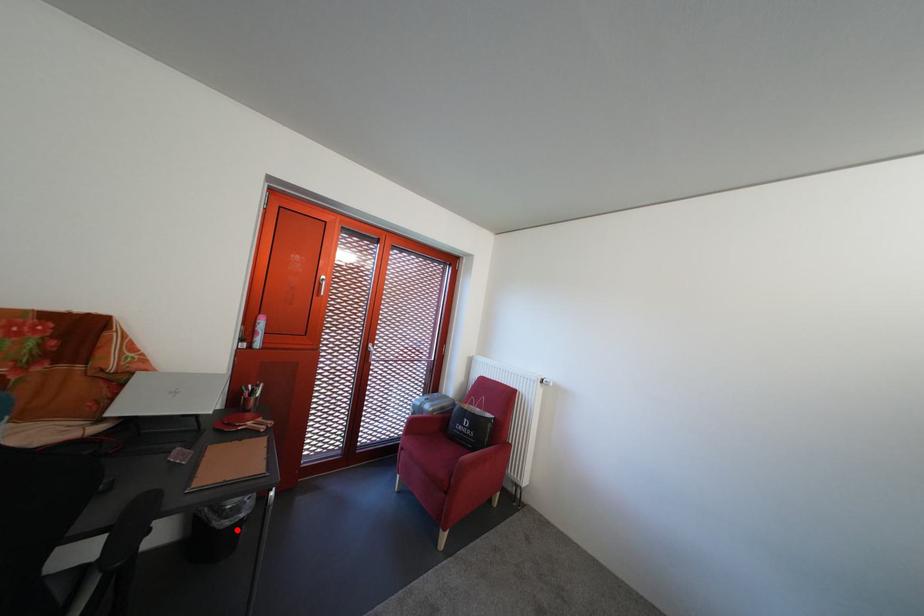
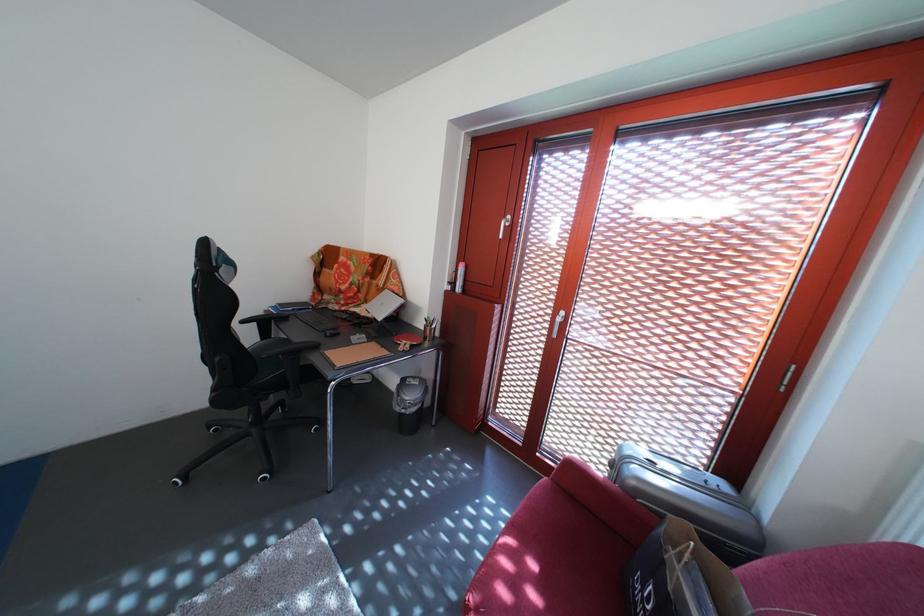
Question: I am providing you with two images of the same scene from different viewpoints. A red point is shown in image1. For the corresponding object point in image2, is it positioned nearer or farther from the camera?

Choices:
 (A) Nearer
 (B) Farther

Answer: (B)